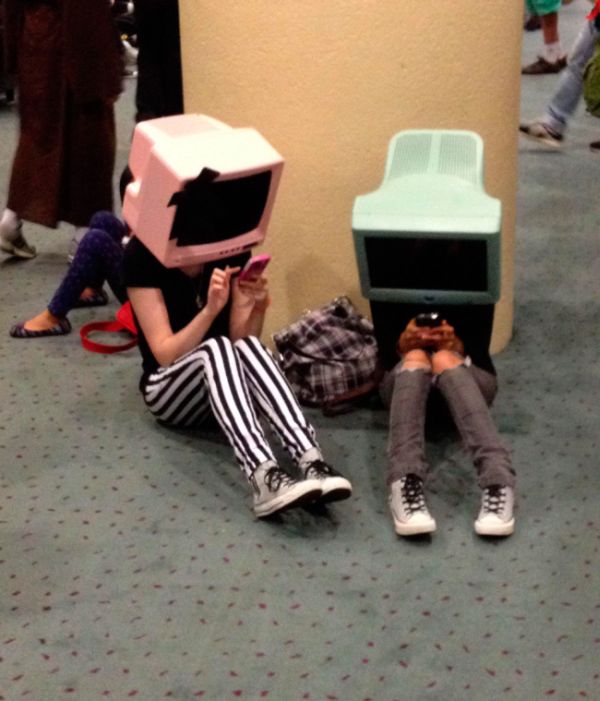
In order to click on 1 green monitor in this screenshot , I will do `click(415, 216)`.